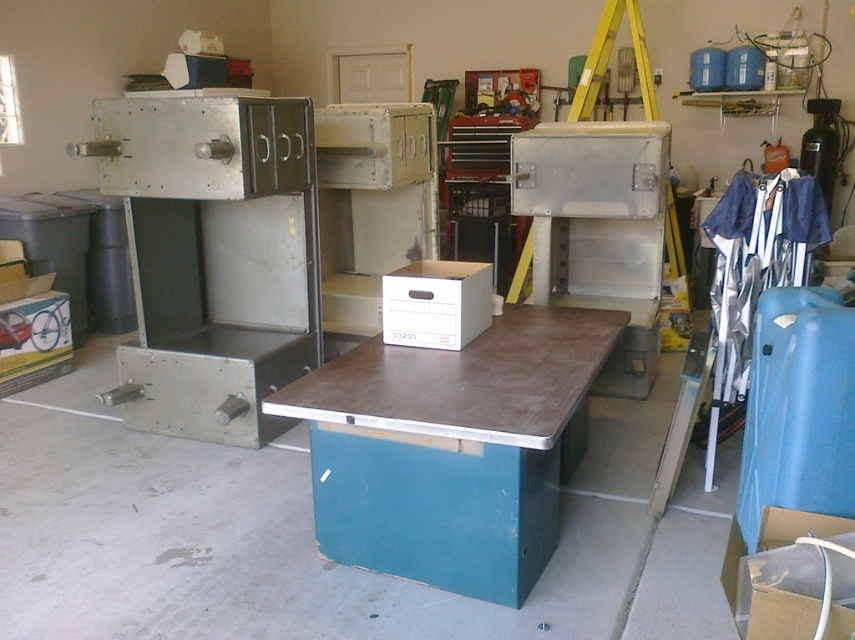
Does white cardboard box at center have a lesser height compared to cardboard box at lower right?

Correct, white cardboard box at center is not as tall as cardboard box at lower right.

In the scene shown: Does white cardboard box at center have a smaller size compared to cardboard box at lower right?

Yes.

Which is behind, point (385, 284) or point (805, 528)?

The point (385, 284) is more distant.

You are a GUI agent. You are given a task and a screenshot of the screen. Output one action in this format:
    pyautogui.click(x=<x>, y=<y>)
    Task: Click on the white cardboard box at center
    This screenshot has width=855, height=640.
    Given the screenshot: What is the action you would take?
    pyautogui.click(x=435, y=304)

Describe the element at coordinates (452, 449) in the screenshot. I see `brown/metallic table at center` at that location.

Which is above, brown/metallic table at center or metallic gray machine at left?

metallic gray machine at left

The width and height of the screenshot is (855, 640). What do you see at coordinates (452, 449) in the screenshot?
I see `brown/metallic table at center` at bounding box center [452, 449].

The width and height of the screenshot is (855, 640). What are the coordinates of `brown/metallic table at center` in the screenshot? It's located at (452, 449).

Does metallic gray machine at left have a lesser width compared to white cardboard box at center?

In fact, metallic gray machine at left might be wider than white cardboard box at center.

Can you confirm if metallic gray machine at left is positioned below white cardboard box at center?

Incorrect, metallic gray machine at left is not positioned below white cardboard box at center.

Who is more forward, [263,432] or [472,305]?

Point [472,305]

Image resolution: width=855 pixels, height=640 pixels. In order to click on metallic gray machine at left in this screenshot , I will do `click(213, 257)`.